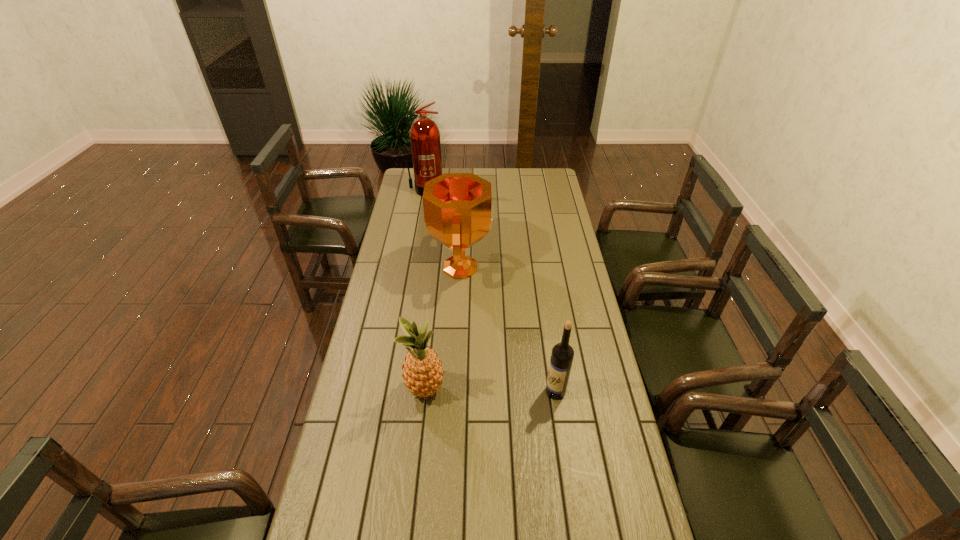
At what (x,y) coordinates should I click in order to perform the action: click on fire extinguisher. Please return your answer as a coordinate pair (x, y). Looking at the image, I should click on (424, 134).

Find the location of a particular element. the tallest object is located at coordinates (424, 134).

Image resolution: width=960 pixels, height=540 pixels. In order to click on award in this screenshot , I will do [458, 213].

Find the location of a particular element. Image resolution: width=960 pixels, height=540 pixels. pineapple is located at coordinates (422, 370).

Where is `wine bottle`? wine bottle is located at coordinates (562, 355).

Identify the location of free spot located on the front-facing side of the fire extinguisher. (420, 209).

What are the coordinates of `blank space located 0.230m on the side of the second farthest object with the star emblem` in the screenshot? It's located at (546, 268).

At what (x,y) coordinates should I click in order to perform the action: click on free space located on the right of the pineapple. Please return your answer as a coordinate pair (x, y). This screenshot has width=960, height=540. Looking at the image, I should click on (533, 390).

The height and width of the screenshot is (540, 960). In order to click on vacant space located on the label of the wine bottle in this screenshot , I will do `click(434, 392)`.

The width and height of the screenshot is (960, 540). Identify the location of vacant space located on the label of the wine bottle. (530, 392).